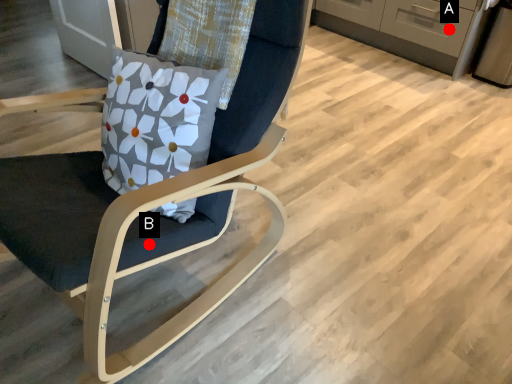
Question: Two points are circled on the image, labeled by A and B beside each circle. Which point is farther to the camera?

Choices:
 (A) A is further
 (B) B is further

Answer: (A)